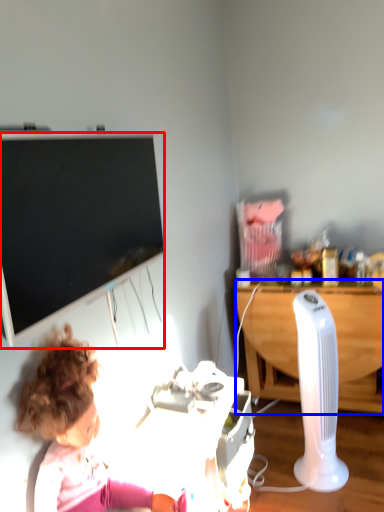
Question: Which of the following is the closest to the observer, television (highlighted by a red box) or desk (highlighted by a blue box)?

Choices:
 (A) television
 (B) desk

Answer: (A)